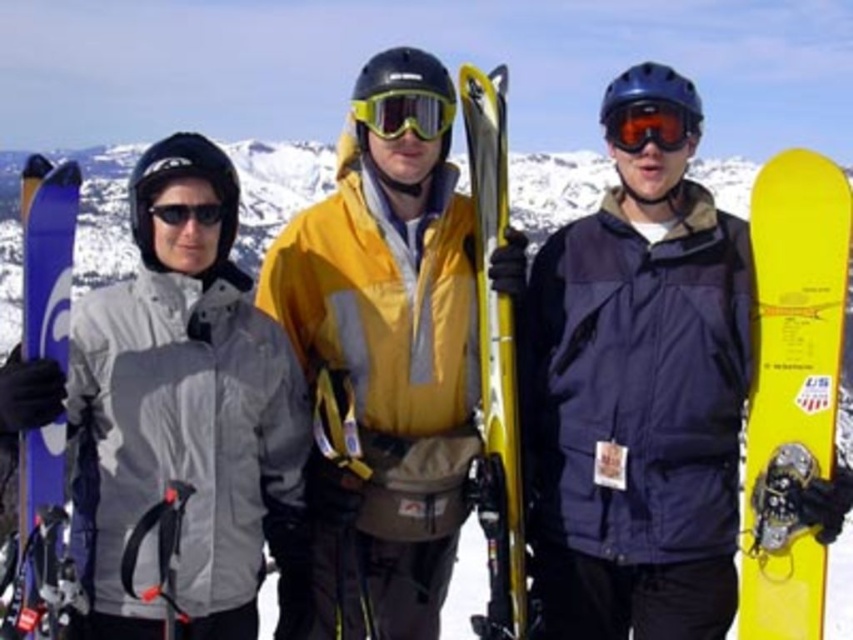
What is the exact coordinate of the yellow matte ski at center?

The yellow matte ski at center is located at point (x=383, y=380).

You are organizing a gear storage area and need to place the yellow matte ski at center and the matte gray jacket at left. Based on their sizes, which item should you store first to maximize space efficiency?

The yellow matte ski at center occupies less space than the matte gray jacket at left, so you should store the matte gray jacket at left first to utilize the space more efficiently.

You are a photographer trying to capture a clear photo of both the yellow matte snowboard at right and the yellow metallic ski at center. Which object should you focus on first to ensure it appears sharp in the foreground?

The yellow matte snowboard at right is closer to the viewer than the yellow metallic ski at center, so you should focus on the yellow matte snowboard at right first to ensure it appears sharp in the foreground.